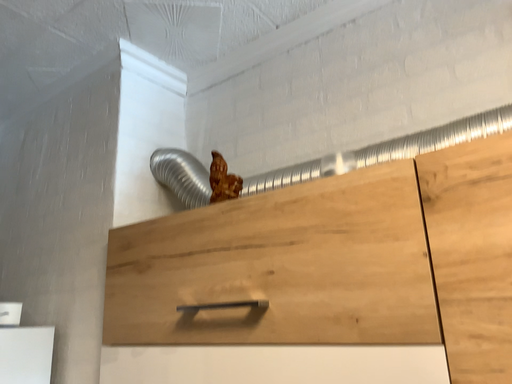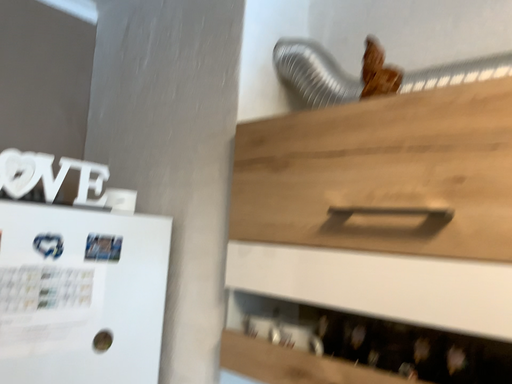
Question: How did the camera likely rotate when shooting the video?

Choices:
 (A) rotated left
 (B) rotated right

Answer: (A)